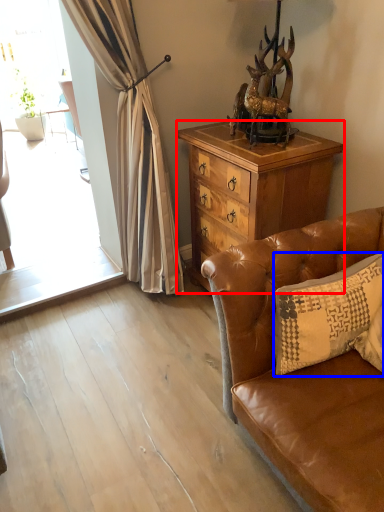
Question: Which of the following is the closest to the observer, cabinetry (highlighted by a red box) or pillow (highlighted by a blue box)?

Choices:
 (A) cabinetry
 (B) pillow

Answer: (B)